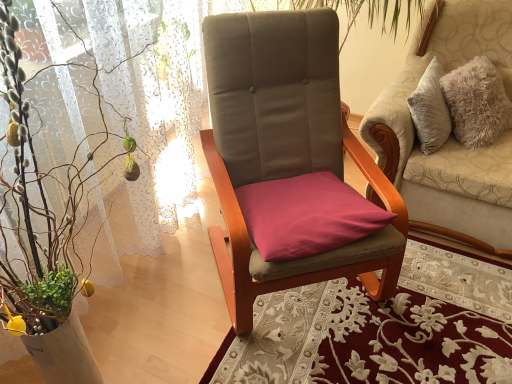
Where is `free space between green leafy plant at left and suede-like beige chair at center, the 1th chair when ordered from left to right`? free space between green leafy plant at left and suede-like beige chair at center, the 1th chair when ordered from left to right is located at coordinates (227, 327).